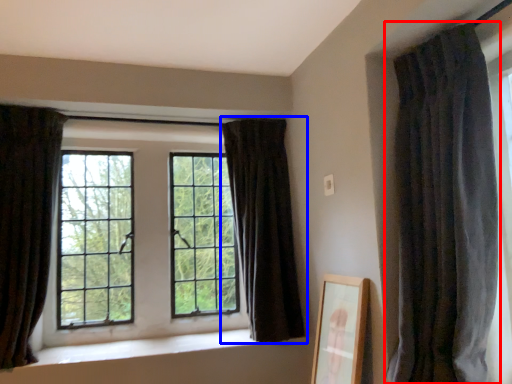
Question: Which object appears closest to the camera in this image, curtain (highlighted by a red box) or curtain (highlighted by a blue box)?

Choices:
 (A) curtain
 (B) curtain

Answer: (A)